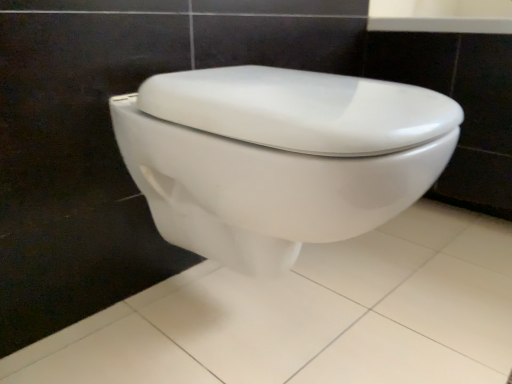
What are the coordinates of `vacant area to the right of white glossy toilet at center` in the screenshot? It's located at (434, 284).